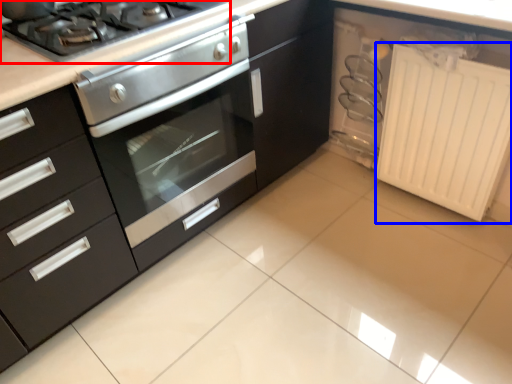
Question: Which object is closer to the camera taking this photo, gas stove (highlighted by a red box) or radiator (highlighted by a blue box)?

Choices:
 (A) gas stove
 (B) radiator

Answer: (A)